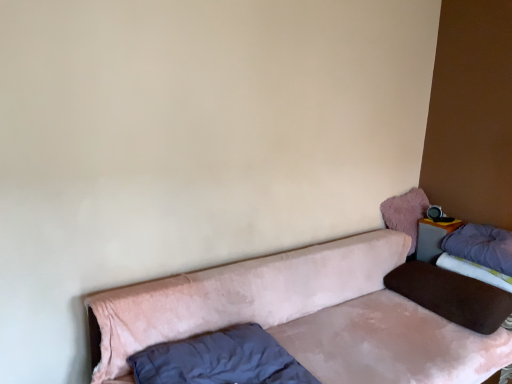
Question: Is velvet pink pillow at upper right, the 2th pillow positioned from the left, surrounding brown velvety pillow at right, placed as the 2th pillow when sorted from right to left?

Choices:
 (A) no
 (B) yes

Answer: (A)

Question: Considering the relative sizes of velvet pink pillow at upper right, positioned as the 3th pillow in right-to-left order, and brown velvety pillow at right, placed as the 2th pillow when sorted from right to left, in the image provided, is velvet pink pillow at upper right, positioned as the 3th pillow in right-to-left order, smaller than brown velvety pillow at right, placed as the 2th pillow when sorted from right to left,?

Choices:
 (A) no
 (B) yes

Answer: (B)

Question: Is velvet pink pillow at upper right, the 2th pillow positioned from the left, aimed at brown velvety pillow at right, placed as the 2th pillow when sorted from right to left?

Choices:
 (A) no
 (B) yes

Answer: (A)

Question: Is velvet pink pillow at upper right, positioned as the 3th pillow in right-to-left order, not near brown velvety pillow at right, placed as the 2th pillow when sorted from right to left?

Choices:
 (A) yes
 (B) no

Answer: (B)

Question: Is velvet pink pillow at upper right, the 2th pillow positioned from the left, looking in the opposite direction of brown velvety pillow at right, the 3th pillow positioned from the left?

Choices:
 (A) no
 (B) yes

Answer: (A)

Question: Can you confirm if velvet pink pillow at upper right, positioned as the 3th pillow in right-to-left order, is shorter than brown velvety pillow at right, placed as the 2th pillow when sorted from right to left?

Choices:
 (A) yes
 (B) no

Answer: (B)

Question: Considering the relative positions of brown velvety pillow at right, the 3th pillow positioned from the left, and matte gray table at upper right in the image provided, is brown velvety pillow at right, the 3th pillow positioned from the left, to the left of matte gray table at upper right from the viewer's perspective?

Choices:
 (A) yes
 (B) no

Answer: (A)

Question: Is brown velvety pillow at right, the 3th pillow positioned from the left, wider than matte gray table at upper right?

Choices:
 (A) yes
 (B) no

Answer: (A)

Question: Is brown velvety pillow at right, the 3th pillow positioned from the left, not inside matte gray table at upper right?

Choices:
 (A) yes
 (B) no

Answer: (A)

Question: From the image's perspective, would you say brown velvety pillow at right, placed as the 2th pillow when sorted from right to left, is shown under matte gray table at upper right?

Choices:
 (A) no
 (B) yes

Answer: (B)

Question: Can you confirm if brown velvety pillow at right, the 3th pillow positioned from the left, is shorter than matte gray table at upper right?

Choices:
 (A) yes
 (B) no

Answer: (A)

Question: Is brown velvety pillow at right, placed as the 2th pillow when sorted from right to left, aimed at matte gray table at upper right?

Choices:
 (A) yes
 (B) no

Answer: (B)

Question: Is velvet pink couch at lower center facing away from velvet pink pillow at upper right, the 2th pillow positioned from the left?

Choices:
 (A) yes
 (B) no

Answer: (B)